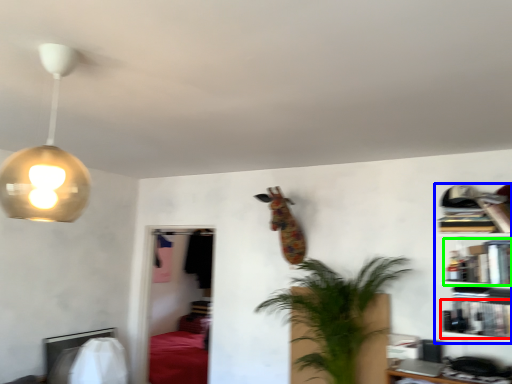
Question: Which object is positioned closest to book (highlighted by a red box)? Select from shelf (highlighted by a blue box) and book (highlighted by a green box).

Choices:
 (A) shelf
 (B) book

Answer: (A)